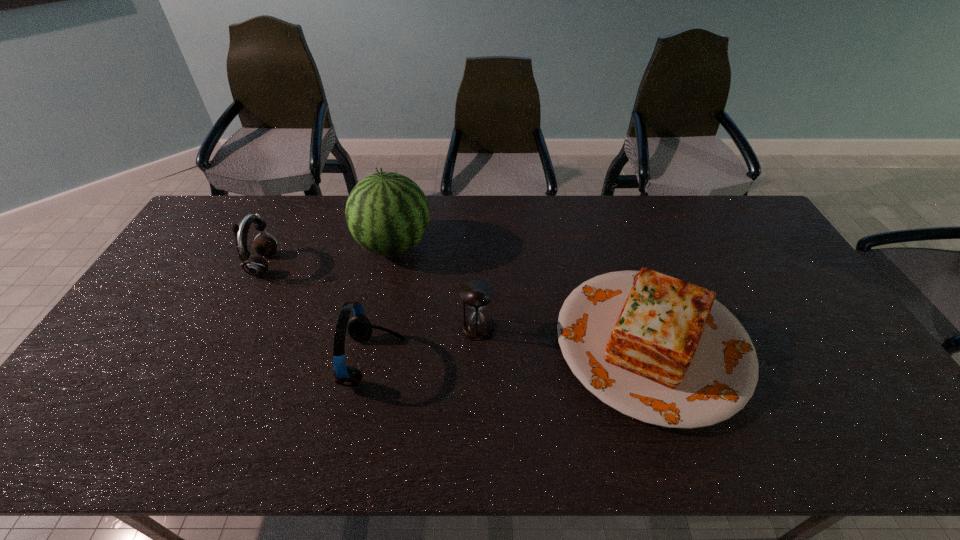
Locate an element on the screen. object at the far edge is located at coordinates (387, 213).

In order to click on object located at the near edge in this screenshot , I will do `click(661, 350)`.

Find the location of a particular element. The image size is (960, 540). vacant position at the far edge of the desktop is located at coordinates (507, 222).

Find the location of `vacant space at the near edge of the desktop`. vacant space at the near edge of the desktop is located at coordinates (756, 433).

This screenshot has height=540, width=960. I want to click on vacant region at the left edge, so click(204, 287).

The image size is (960, 540). In order to click on free space at the right edge of the desktop in this screenshot , I will do `click(834, 339)`.

Image resolution: width=960 pixels, height=540 pixels. In the image, there is a desktop. In order to click on free region at the far left corner in this screenshot , I will do `click(233, 224)`.

Locate an element on the screen. The height and width of the screenshot is (540, 960). vacant area that lies between the earphone and the tallest object is located at coordinates (328, 255).

Image resolution: width=960 pixels, height=540 pixels. What are the coordinates of `free space between the hourglass and the headset` in the screenshot? It's located at click(425, 345).

Where is `free space between the lasagna and the watermelon`? free space between the lasagna and the watermelon is located at coordinates (522, 294).